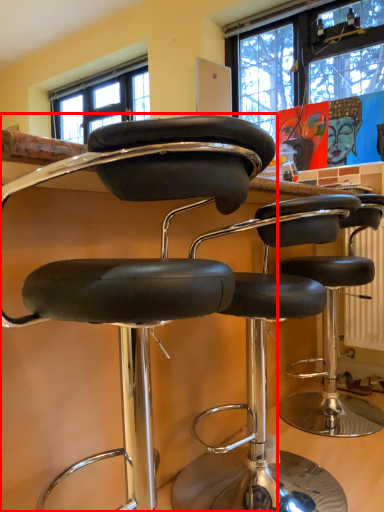
Question: From the image's perspective, where is chair (annotated by the red box) located in relation to chair in the image?

Choices:
 (A) above
 (B) below

Answer: (A)